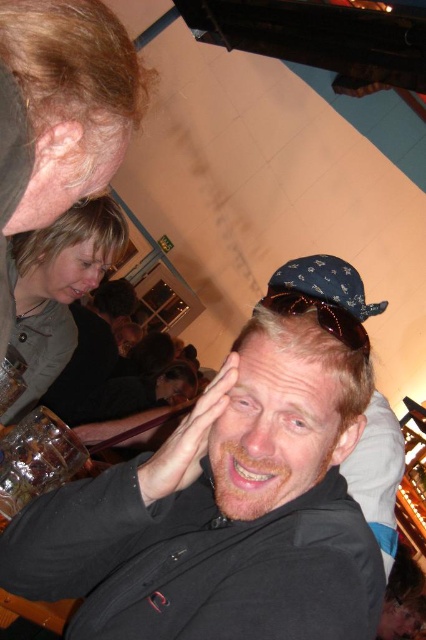
You are a photographer trying to capture a candid shot of the matte black shirt at center and the blonde hair at lower left. Which subject should you focus on first to ensure both are in sharp focus?

You should focus on the matte black shirt at center first because it is closer to the viewer than the blonde hair at lower left, so adjusting focus from near to far will help both be in sharp focus.

Looking at this image, you are a photographer trying to capture the perfect shot of the smooth skin hand at center. You want to position your camera so that the hand is exactly at the center of the frame. Given its current 2D coordinates, is the hand already centered, or does it need adjustment? Please explain.

The smooth skin hand at center is located at coordinates point (187, 440), which is not the exact center of the frame. To center it, adjustments would be needed as the true center would be at (213, 320) in normalized coordinates.

You are a photographer trying to capture a candid shot of the blonde hair at upper left and the matte black hair at upper left. Which hair is closer to the camera?

The blonde hair at upper left is positioned under matte black hair at upper left, meaning the matte black hair at upper left is closer to the camera.